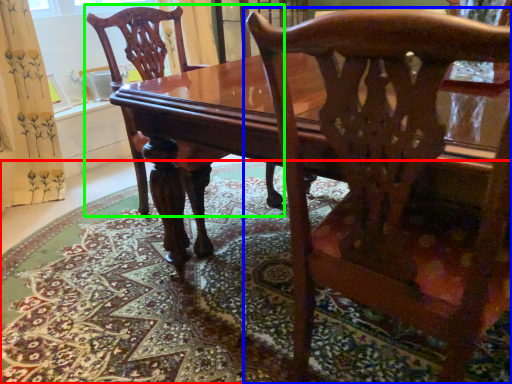
Question: Based on their relative distances, which object is nearer to mat (highlighted by a red box)? Choose from chair (highlighted by a blue box) and chair (highlighted by a green box).

Choices:
 (A) chair
 (B) chair

Answer: (B)